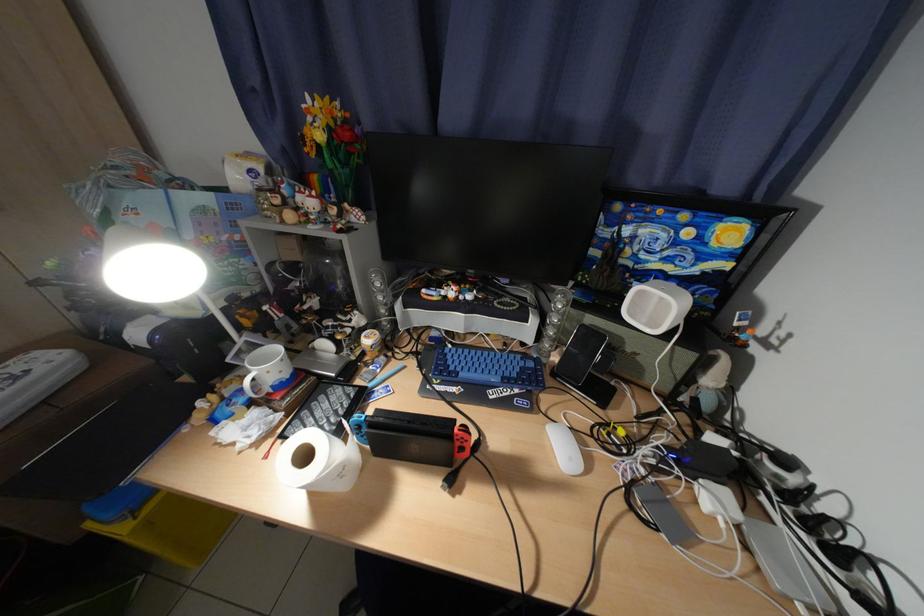
What do you see at coordinates (675, 246) in the screenshot? I see `the blue joy-con` at bounding box center [675, 246].